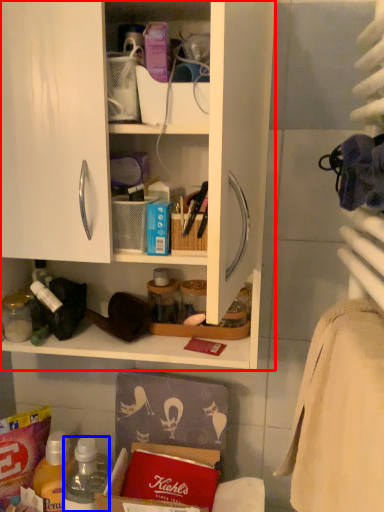
Question: Among these objects, which one is nearest to the camera, cabinetry (highlighted by a red box) or bottle (highlighted by a blue box)?

Choices:
 (A) cabinetry
 (B) bottle

Answer: (A)